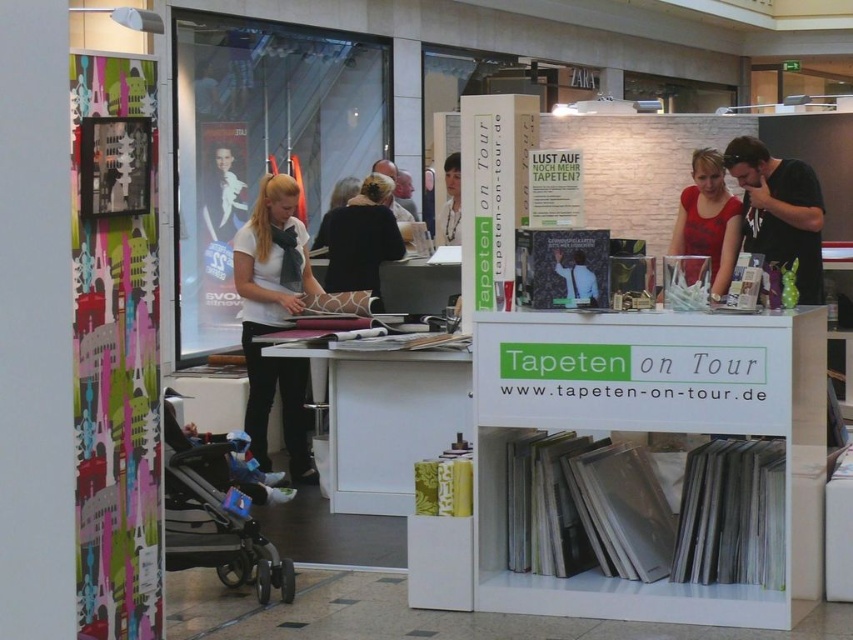
In the scene shown: Is black plastic baby carriage at lower left to the left of black matte shirt at upper right from the viewer's perspective?

Correct, you'll find black plastic baby carriage at lower left to the left of black matte shirt at upper right.

Between point (215, 492) and point (795, 196), which one is positioned behind?

The point (795, 196) is more distant.

Between point (276, 577) and point (744, 228), which one is positioned in front?

Positioned in front is point (276, 577).

This screenshot has height=640, width=853. I want to click on black plastic baby carriage at lower left, so click(x=219, y=509).

Does black plastic baby carriage at lower left lie behind black leather jacket at center?

No, black plastic baby carriage at lower left is in front of black leather jacket at center.

Does black plastic baby carriage at lower left have a greater height compared to black leather jacket at center?

No, black plastic baby carriage at lower left is not taller than black leather jacket at center.

Describe the element at coordinates (219, 509) in the screenshot. I see `black plastic baby carriage at lower left` at that location.

This screenshot has height=640, width=853. What are the coordinates of `black plastic baby carriage at lower left` in the screenshot? It's located at (219, 509).

Is black leather jacket at center above white fabric shirt at upper center?

Incorrect, black leather jacket at center is not positioned above white fabric shirt at upper center.

Does black leather jacket at center come behind white fabric shirt at upper center?

No, black leather jacket at center is closer to the viewer.

Is point (380, 240) closer to camera compared to point (444, 168)?

Yes, point (380, 240) is in front of point (444, 168).

The image size is (853, 640). I want to click on black leather jacket at center, so click(x=360, y=237).